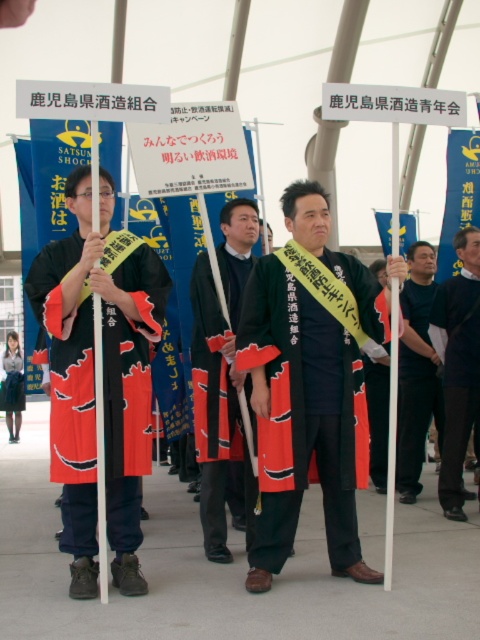
You are standing at the origin point in the image. Which direction should you move to reach the red velvet kimono at center?

The red velvet kimono at center is located at point 0.609 on the x and 0.271 on the y. Since you are at the origin, you should move to the right and slightly upward to reach it.

You are attending this formal event and want to take a photo of the red velvet kimono at center and the dark gray suit at right. Which one will appear larger in your photo?

The red velvet kimono at center will appear larger in your photo since it is closer to the viewer than the dark gray suit at right.